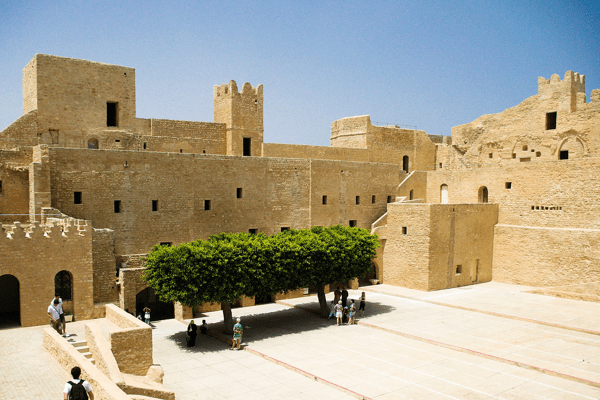
The height and width of the screenshot is (400, 600). In order to click on wall in this screenshot , I will do `click(126, 344)`.